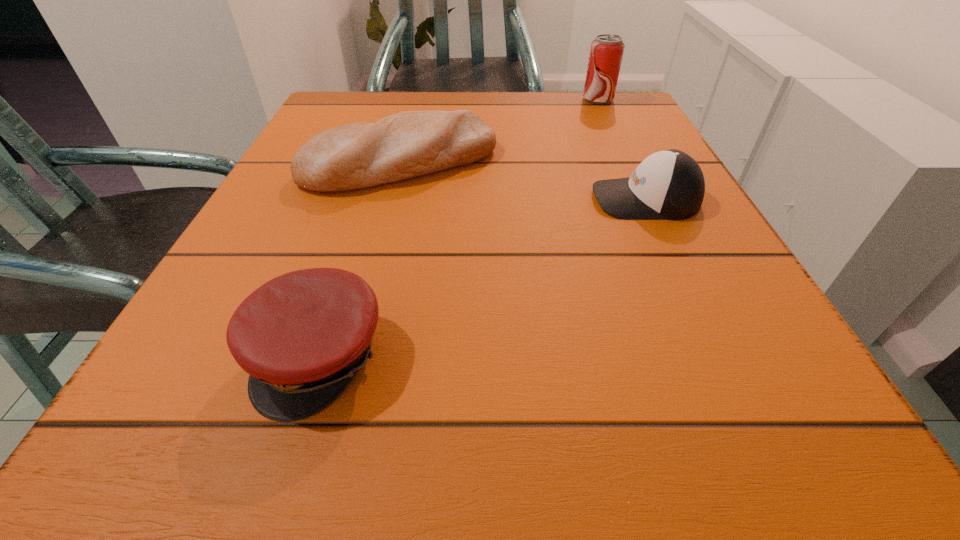
Find the location of a particular element. The height and width of the screenshot is (540, 960). object that is positioned at the near left corner is located at coordinates (302, 337).

You are a GUI agent. You are given a task and a screenshot of the screen. Output one action in this format:
    pyautogui.click(x=<x>, y=<y>)
    Task: Click on the object present at the far right corner
    This screenshot has height=540, width=960.
    Given the screenshot: What is the action you would take?
    click(x=606, y=52)

Locate an element on the screen. blank space at the far edge of the desktop is located at coordinates tap(553, 134).

Where is `vacant space at the left edge of the desktop`? vacant space at the left edge of the desktop is located at coordinates (263, 266).

Where is `free space at the right edge of the desktop`? This screenshot has width=960, height=540. free space at the right edge of the desktop is located at coordinates (732, 360).

This screenshot has height=540, width=960. In the image, there is a desktop. Identify the location of vacant space at the far left corner. point(354,103).

Where is `vacant space at the near left corner`? vacant space at the near left corner is located at coordinates (252, 450).

Find the location of `vacant space at the far right corner of the desktop`. vacant space at the far right corner of the desktop is located at coordinates (645, 115).

Where is `free location at the near right corner`? This screenshot has height=540, width=960. free location at the near right corner is located at coordinates (697, 432).

Find the location of a particular element. The width and height of the screenshot is (960, 540). free point between the tallest object and the bread is located at coordinates (499, 131).